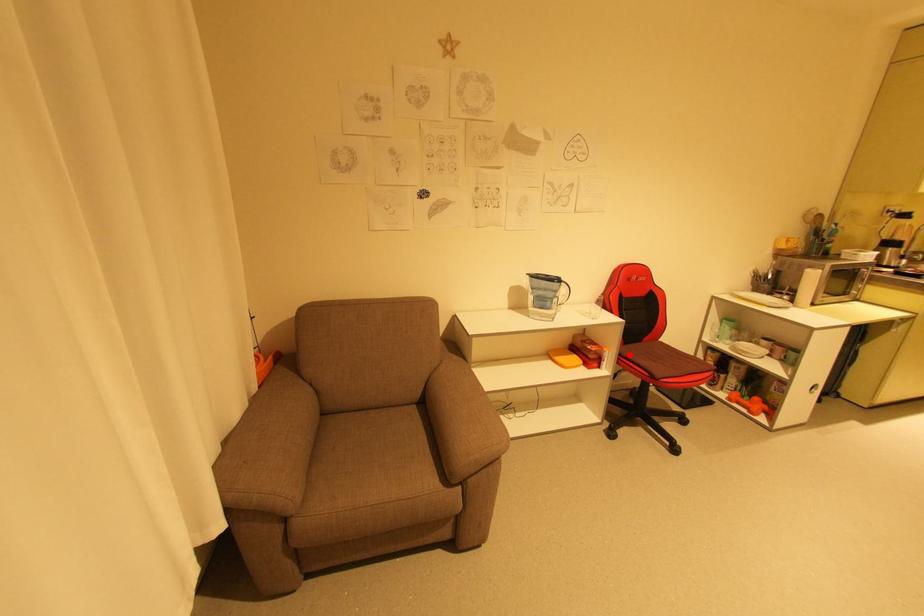
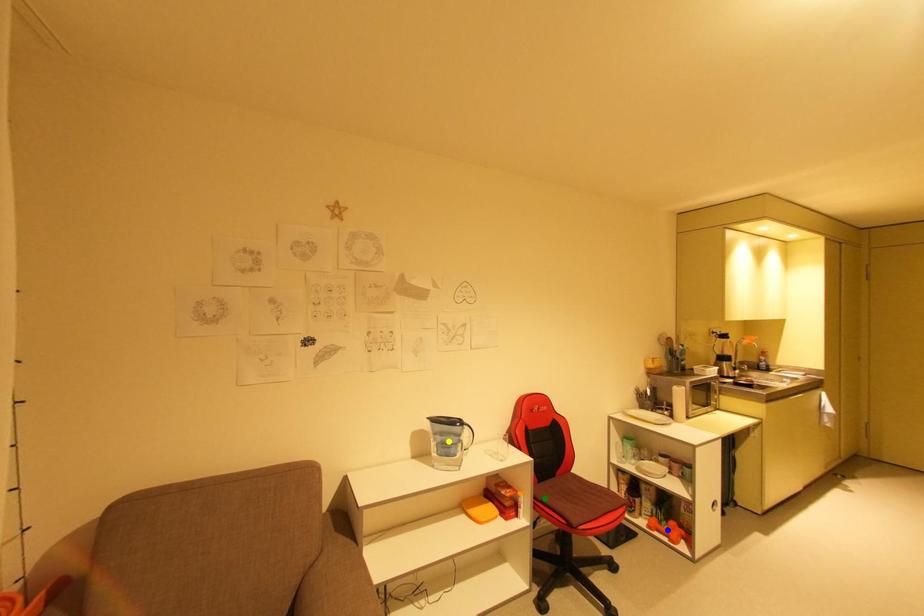
Question: I am providing you with two images of the same scene from different viewpoints. A red point is marked on the first image. You are given multiple points on the second image. Which mark in image 2 goes with the point in image 1?

Choices:
 (A) blue point
 (B) yellow point
 (C) green point

Answer: (C)